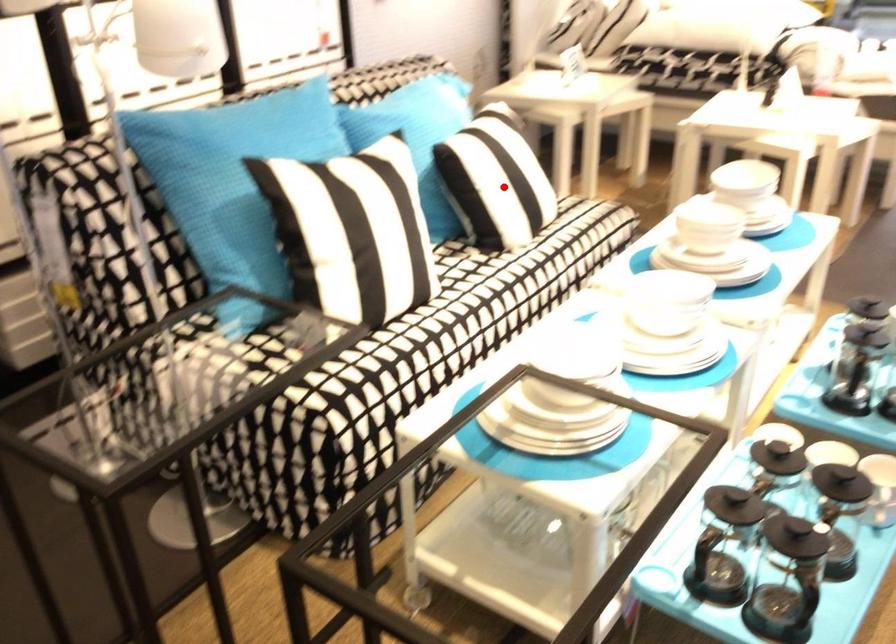
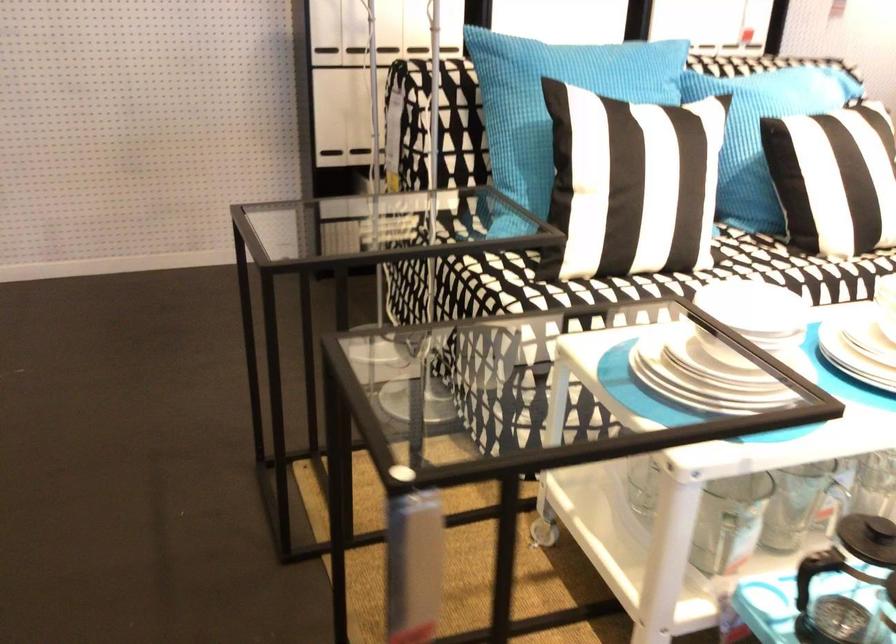
Question: I am providing you with two images of the same scene from different viewpoints. A red point is shown in image1. For the corresponding object point in image2, is it positioned nearer or farther from the camera?

Choices:
 (A) Nearer
 (B) Farther

Answer: (A)